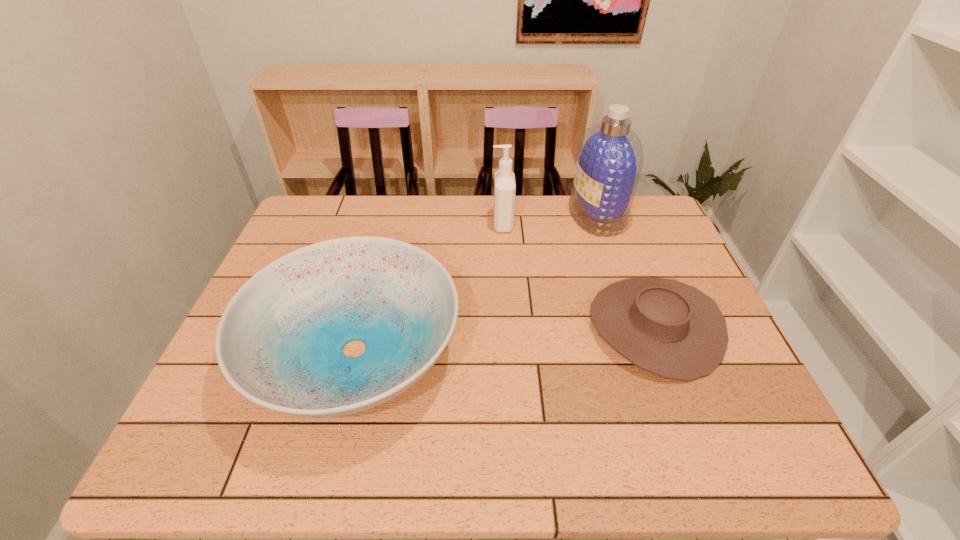
Where is `free space located 0.260m on the front label of the second object from left to right`? The height and width of the screenshot is (540, 960). free space located 0.260m on the front label of the second object from left to right is located at coordinates (411, 224).

Where is `vacant space positioned on the right of the second shortest object`? vacant space positioned on the right of the second shortest object is located at coordinates (578, 349).

Locate an element on the screen. The height and width of the screenshot is (540, 960). vacant space located on the back of the cowboy hat is located at coordinates (609, 204).

At what (x,y) coordinates should I click in order to perform the action: click on object situated at the near edge. Please return your answer as a coordinate pair (x, y). Looking at the image, I should click on (279, 343).

Image resolution: width=960 pixels, height=540 pixels. Find the location of `object at the left edge`. object at the left edge is located at coordinates (279, 343).

Identify the location of cleansing agent present at the right edge. This screenshot has height=540, width=960. (610, 157).

Where is `cowboy hat located at the right edge`? cowboy hat located at the right edge is located at coordinates (668, 328).

Locate an element on the screen. Image resolution: width=960 pixels, height=540 pixels. object at the near left corner is located at coordinates (279, 343).

I want to click on object that is at the far right corner, so click(610, 157).

This screenshot has width=960, height=540. In the image, there is a desktop. Identify the location of free space at the far edge. point(465,230).